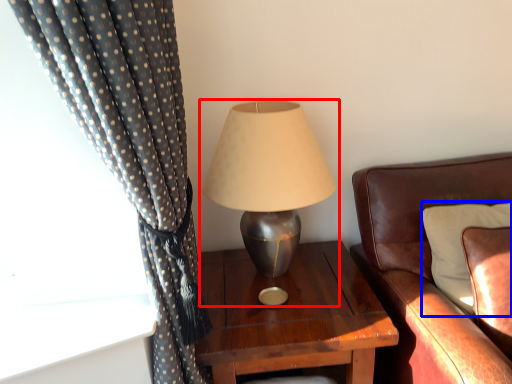
Question: Among these objects, which one is farthest to the camera, lamp (highlighted by a red box) or pillow (highlighted by a blue box)?

Choices:
 (A) lamp
 (B) pillow

Answer: (A)